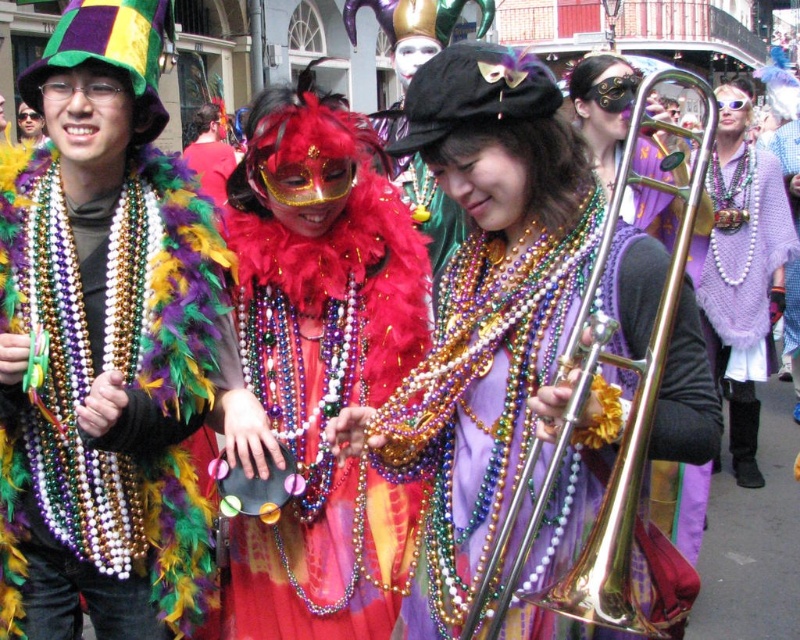
You are at the Mardi Gras celebration and want to take a photo of both the person on the left and the individual in the center. If you position yourself so that you are facing the point at (218, 182), will the person at point (746, 112) be in front of or behind the individual in the center?

The point at (746, 112) is behind the point at (218, 182), so the person at point (746, 112) will be behind the individual in the center when you take the photo.

You are organizing a Mardi Gras costume display and need to arrange the feather boa at center and pearl knitted shawl at right on a shelf. If the shelf has limited space, which item should you place first to ensure both fit?

The feather boa at center should be placed first because it occupies less space than the pearl knitted shawl at right, allowing both items to fit on the shelf.